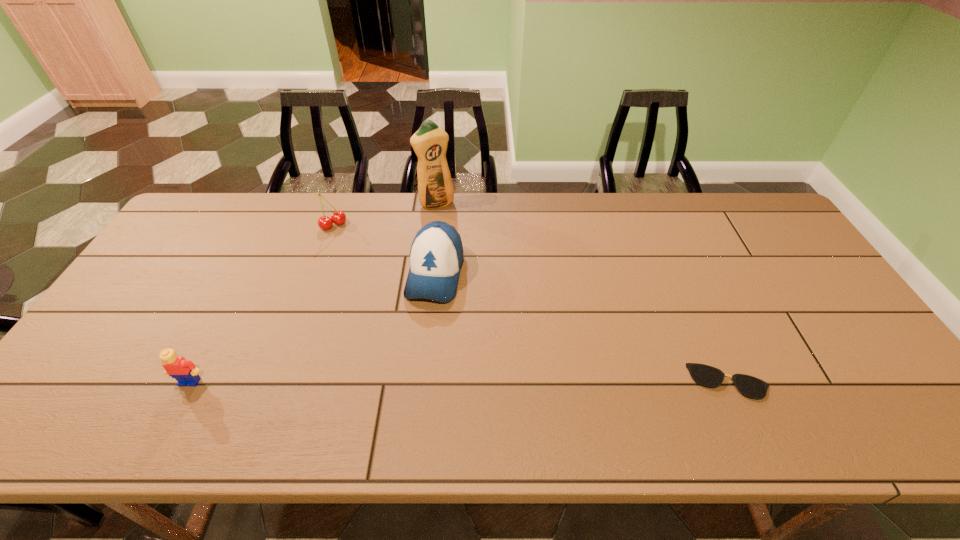
The image size is (960, 540). What are the coordinates of `free space located 0.130m on the label of the farthest object` in the screenshot? It's located at (455, 234).

Find the location of a particular element. vacant space located 0.160m on the label of the farthest object is located at coordinates (458, 240).

I want to click on free space located 0.290m with the stems of the second object from left to right pointing upwards, so click(x=378, y=286).

Where is `vacant space situated 0.250m with the stems of the second object from left to right pointing upwards`? The image size is (960, 540). vacant space situated 0.250m with the stems of the second object from left to right pointing upwards is located at coordinates (372, 277).

Find the location of a particular element. The image size is (960, 540). free spot located 0.240m with the stems of the second object from left to right pointing upwards is located at coordinates tap(371, 275).

The width and height of the screenshot is (960, 540). In order to click on free space located 0.100m on the front-facing side of the third farthest object in this screenshot , I will do `click(420, 339)`.

What are the coordinates of `vacant point located 0.130m on the front-facing side of the third farthest object` in the screenshot? It's located at (417, 348).

At what (x,y) coordinates should I click in order to perform the action: click on vacant space located 0.140m on the front-facing side of the third farthest object. Please return your answer as a coordinate pair (x, y). This screenshot has height=540, width=960. Looking at the image, I should click on [x=416, y=352].

Locate an element on the screen. Image resolution: width=960 pixels, height=540 pixels. detergent at the far edge is located at coordinates (435, 188).

This screenshot has width=960, height=540. I want to click on cherry situated at the far edge, so click(x=338, y=217).